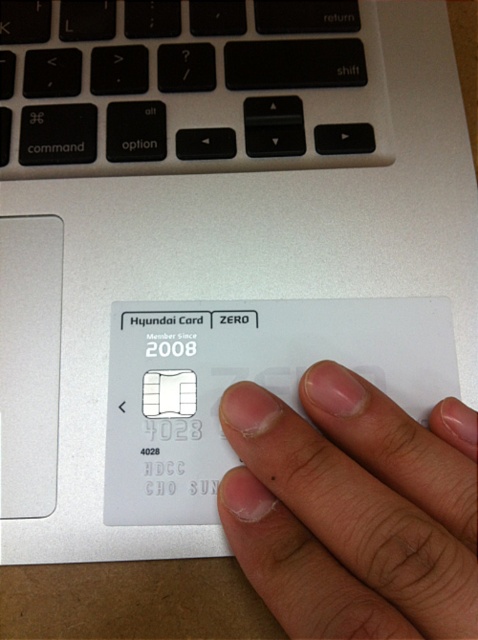
Question: Which object is positioned closest to the nail polish matte finger at center?

Choices:
 (A) white plastic card at center
 (B) black plastic keyboard at upper center

Answer: (A)

Question: Which of the following is the closest to the observer?

Choices:
 (A) white plastic card at center
 (B) black plastic keyboard at upper center
 (C) nail polish matte finger at center

Answer: (C)

Question: Is nail polish matte finger at center further to the viewer compared to white plastic card at center?

Choices:
 (A) no
 (B) yes

Answer: (A)

Question: Is nail polish matte finger at center below white plastic card at center?

Choices:
 (A) no
 (B) yes

Answer: (B)

Question: Which of these objects is positioned closest to the white plastic card at center?

Choices:
 (A) black plastic keyboard at upper center
 (B) nail polish matte finger at center

Answer: (B)

Question: Is black plastic keyboard at upper center closer to the viewer compared to nail polish matte finger at center?

Choices:
 (A) yes
 (B) no

Answer: (B)